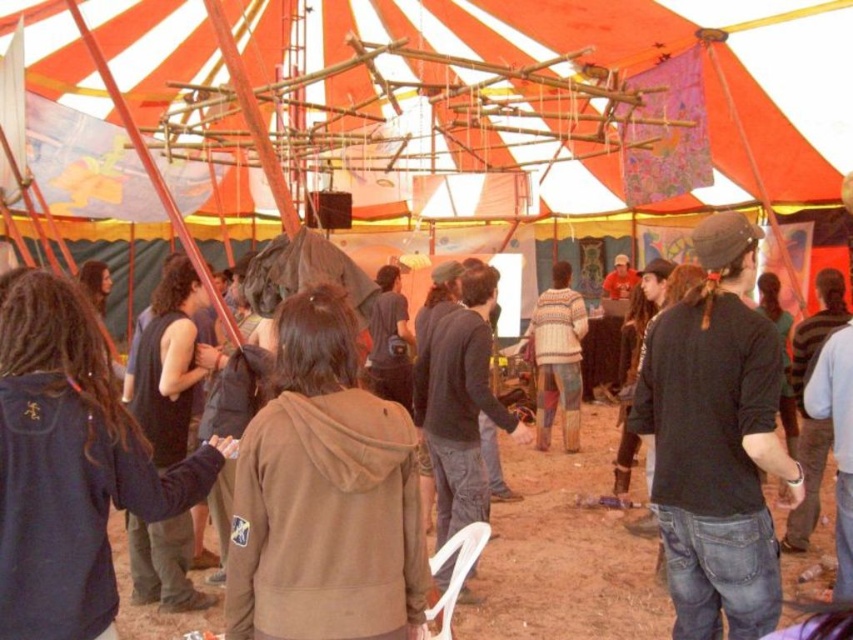
Does brown fleece jacket at center have a smaller size compared to dark blue hoodie at center?

Indeed, brown fleece jacket at center has a smaller size compared to dark blue hoodie at center.

Which is above, brown fleece jacket at center or dark blue hoodie at center?

dark blue hoodie at center is above.

Who is more forward, (244, 492) or (26, 452)?

Point (26, 452)

Where is `brown fleece jacket at center`? The height and width of the screenshot is (640, 853). brown fleece jacket at center is located at coordinates (323, 496).

Does dark brown hair at left appear under knitted sweater at center?

Actually, dark brown hair at left is above knitted sweater at center.

Which is behind, point (163, 348) or point (548, 438)?

Positioned behind is point (548, 438).

The height and width of the screenshot is (640, 853). I want to click on dark brown hair at left, so click(x=167, y=364).

Who is positioned more to the left, dark blue hoodie at center or knitted sweater at center?

Positioned to the left is dark blue hoodie at center.

Between dark blue hoodie at center and knitted sweater at center, which one appears on the right side from the viewer's perspective?

knitted sweater at center

Is point (44, 412) farther from camera compared to point (556, 268)?

No, it is not.

The height and width of the screenshot is (640, 853). Find the location of `dark blue hoodie at center`. dark blue hoodie at center is located at coordinates (71, 465).